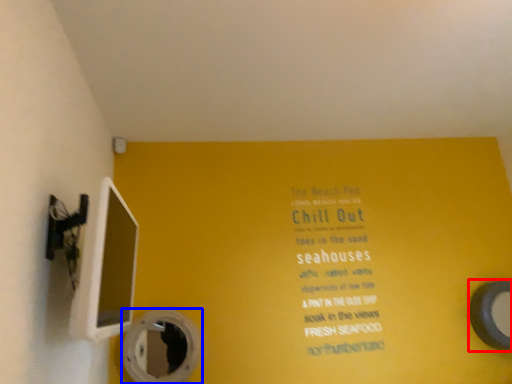
Question: Which of the following is the farthest to the observer, mirror (highlighted by a red box) or mirror (highlighted by a blue box)?

Choices:
 (A) mirror
 (B) mirror

Answer: (A)